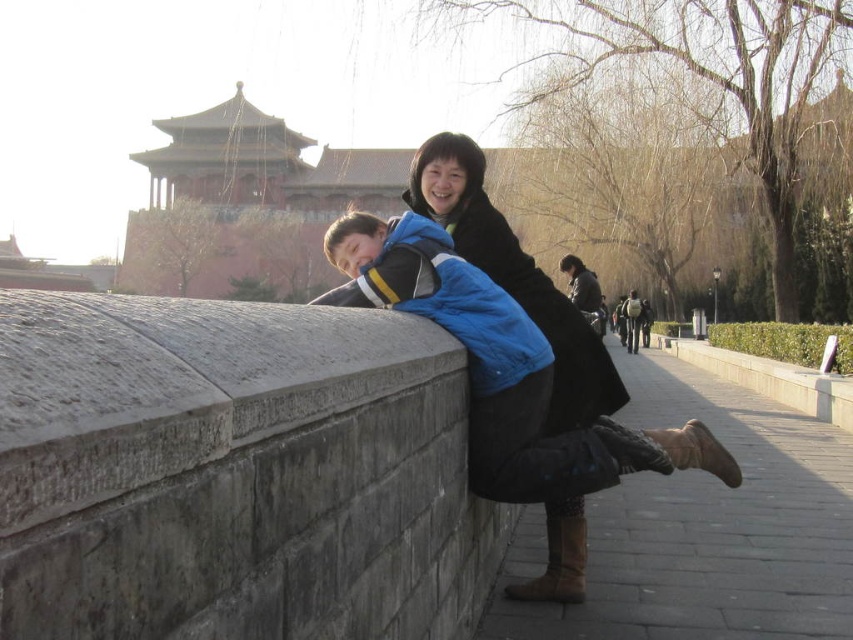
Question: Observing the image, what is the correct spatial positioning of brown suede boot at lower center in reference to brown suede boot at lower right?

Choices:
 (A) right
 (B) left

Answer: (B)

Question: Among these objects, which one is farthest from the camera?

Choices:
 (A) brown suede boot at lower right
 (B) matte blue jacket at center

Answer: (B)

Question: Estimate the real-world distances between objects in this image. Which object is closer to the brown suede boot at lower right?

Choices:
 (A) matte blue jacket at center
 (B) brown suede boot at lower center

Answer: (B)

Question: Is brown suede boot at lower center to the left of brown suede boot at lower right from the viewer's perspective?

Choices:
 (A) yes
 (B) no

Answer: (A)

Question: Can you confirm if matte blue jacket at center is positioned to the left of brown suede boot at lower center?

Choices:
 (A) no
 (B) yes

Answer: (B)

Question: Based on their relative distances, which object is farther from the brown suede boot at lower center?

Choices:
 (A) matte blue jacket at center
 (B) brown suede boot at lower right

Answer: (B)